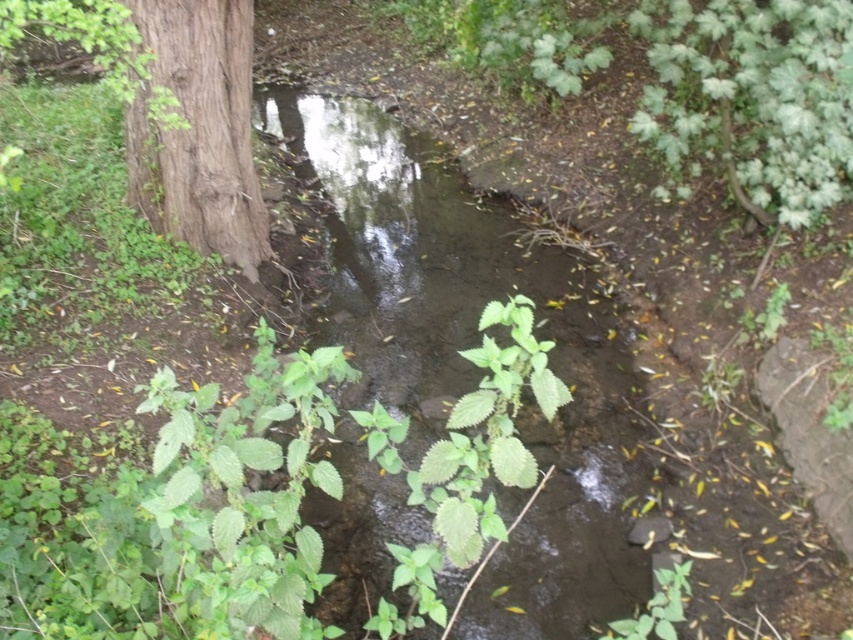
Question: In this image, where is transparent water at center located relative to brown rough tree trunk at left?

Choices:
 (A) right
 (B) left

Answer: (A)

Question: Is transparent water at center to the left of brown rough tree trunk at left from the viewer's perspective?

Choices:
 (A) no
 (B) yes

Answer: (A)

Question: Does transparent water at center come behind brown rough tree trunk at left?

Choices:
 (A) no
 (B) yes

Answer: (A)